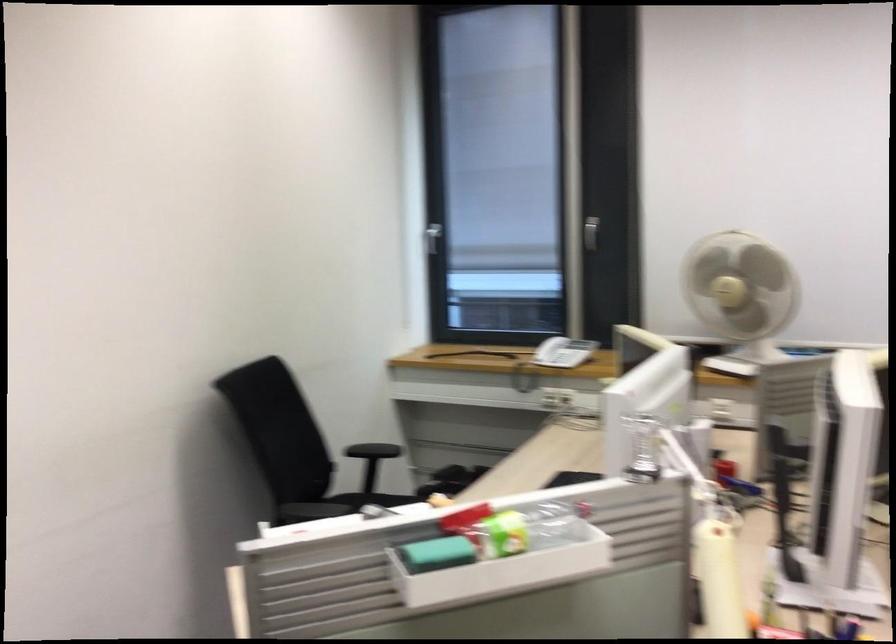
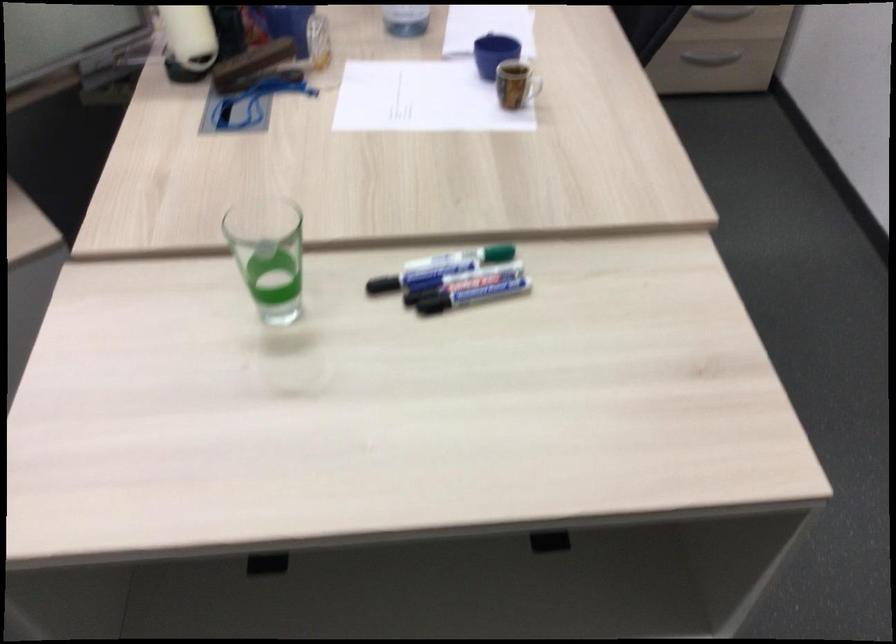
First-person continuous shooting, in which direction is the camera rotating?

The camera's rotation is toward right-down.